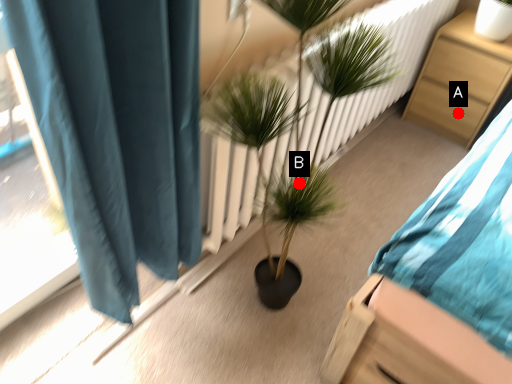
Question: Two points are circled on the image, labeled by A and B beside each circle. Which of the following is the closest to the observer?

Choices:
 (A) A is closer
 (B) B is closer

Answer: (B)